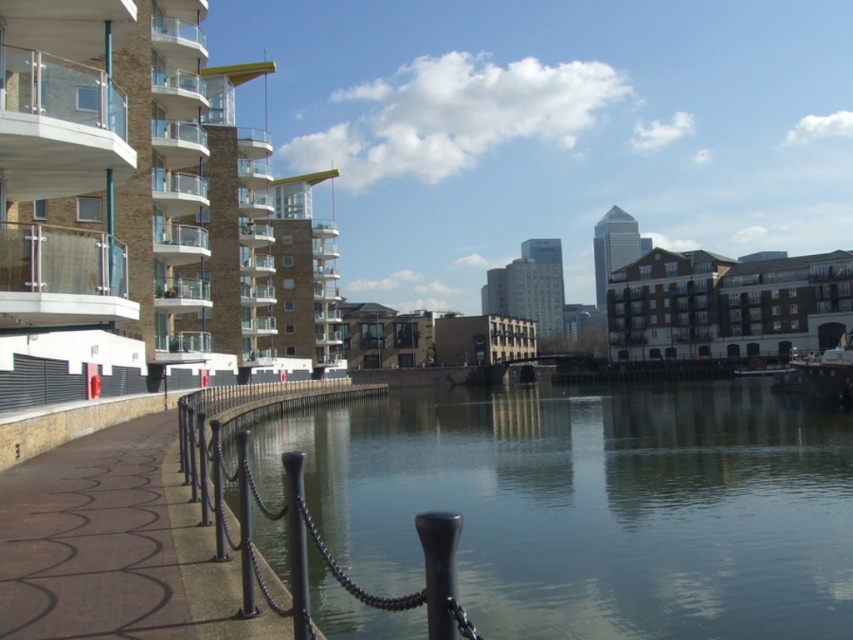
Question: Is greenish-gray water at center to the left of brown textured pavement at lower left from the viewer's perspective?

Choices:
 (A) no
 (B) yes

Answer: (A)

Question: Which point is farther from the camera taking this photo?

Choices:
 (A) (33, 513)
 (B) (514, 564)

Answer: (B)

Question: Does greenish-gray water at center have a greater width compared to brown textured pavement at lower left?

Choices:
 (A) no
 (B) yes

Answer: (B)

Question: Which point is farther from the camera taking this photo?

Choices:
 (A) (105, 493)
 (B) (541, 582)

Answer: (B)

Question: From the image, what is the correct spatial relationship of greenish-gray water at center in relation to brown textured pavement at lower left?

Choices:
 (A) left
 (B) right

Answer: (B)